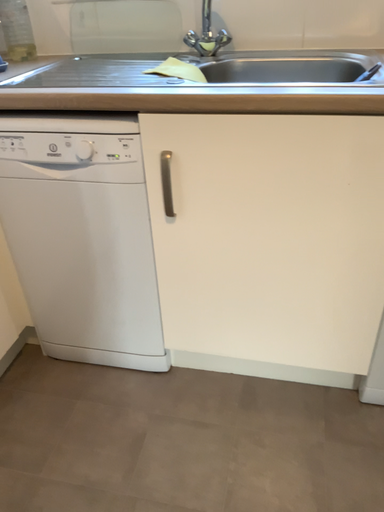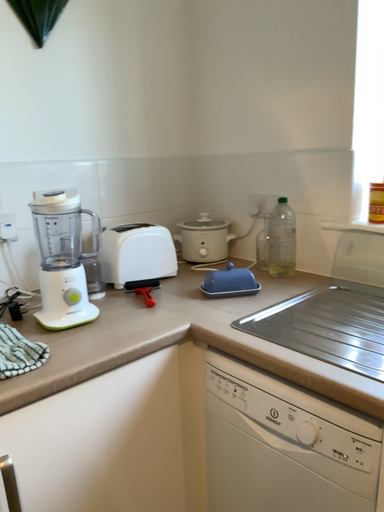
Question: How did the camera likely rotate when shooting the video?

Choices:
 (A) rotated right
 (B) rotated left

Answer: (B)